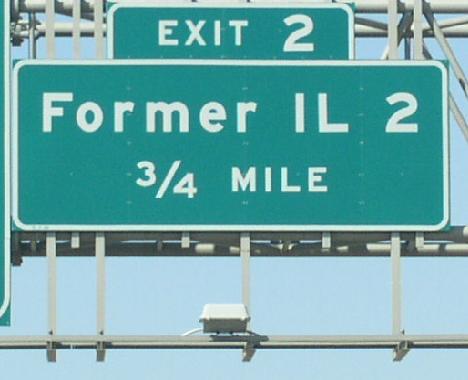
Identify the location of corners. This screenshot has height=380, width=468. (15, 62), (443, 64), (447, 226), (16, 228).